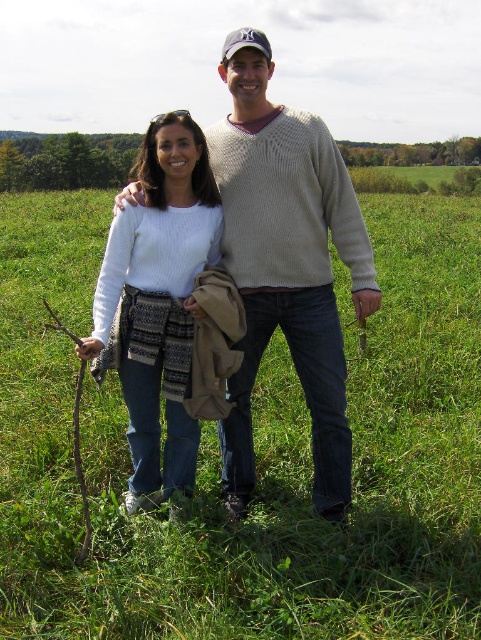
From the picture: You are a photographer trying to capture a clear photo of the white knitted sweater at center without the brown rough twig at lower left blocking it. Based on their positions, is this possible?

The brown rough twig at lower left is behind the white knitted sweater at center, so it won t block the view of the sweater. You can take a clear photo of the white knitted sweater at center without the twig obstructing it.

You are standing at the point with coordinates point (80, 362) and want to walk to the point with coordinates point (213, 257). According to the image, will you pass by the man in the beige sweater on your way?

Yes, because point (213, 257) is in front of point (80, 362), so walking from point (80, 362) to point (213, 257) would mean moving towards the man in the beige sweater, who is located between the two points.

You are a photographer trying to capture a photo of the green grassy field at center and the white knit sweater at center. Which object should you adjust your camera to focus on first if you want to include both in the frame?

The white knit sweater at center should be focused on first because it is to the left of the green grassy field at center, so adjusting focus starting from the left ensures both are in frame.